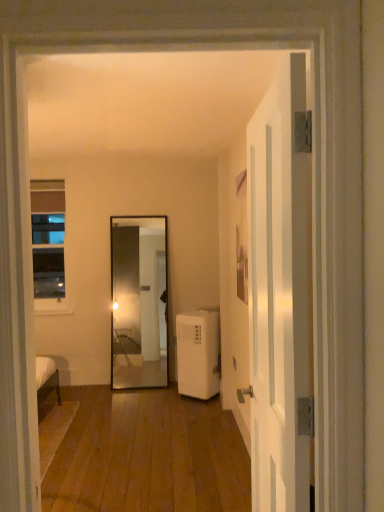
Question: Is white glossy door at right to the left of clear glass window at left from the viewer's perspective?

Choices:
 (A) yes
 (B) no

Answer: (B)

Question: Considering the relative sizes of white glossy door at right and clear glass window at left in the image provided, is white glossy door at right shorter than clear glass window at left?

Choices:
 (A) no
 (B) yes

Answer: (A)

Question: From the image's perspective, would you say white glossy door at right is shown under clear glass window at left?

Choices:
 (A) no
 (B) yes

Answer: (B)

Question: Can you confirm if white glossy door at right is positioned to the right of clear glass window at left?

Choices:
 (A) no
 (B) yes

Answer: (B)

Question: Is white glossy door at right outside clear glass window at left?

Choices:
 (A) no
 (B) yes

Answer: (B)

Question: From a real-world perspective, is clear glass window at left physically located above or below white glossy door at right?

Choices:
 (A) above
 (B) below

Answer: (A)

Question: Considering the positions of clear glass window at left and white glossy door at right in the image, is clear glass window at left wider or thinner than white glossy door at right?

Choices:
 (A) wide
 (B) thin

Answer: (B)

Question: Is clear glass window at left in front of or behind white glossy door at right in the image?

Choices:
 (A) front
 (B) behind

Answer: (B)

Question: Is clear glass window at left spatially inside white glossy door at right, or outside of it?

Choices:
 (A) inside
 (B) outside

Answer: (B)

Question: Is point pyautogui.click(x=256, y=237) closer or farther from the camera than point pyautogui.click(x=190, y=324)?

Choices:
 (A) closer
 (B) farther

Answer: (A)

Question: From the image's perspective, is white glossy door at right located above or below white plastic air conditioner at lower right?

Choices:
 (A) below
 (B) above

Answer: (B)

Question: From a real-world perspective, relative to white plastic air conditioner at lower right, is white glossy door at right vertically above or below?

Choices:
 (A) above
 (B) below

Answer: (A)

Question: Is white glossy door at right in front of or behind white plastic air conditioner at lower right in the image?

Choices:
 (A) behind
 (B) front

Answer: (B)

Question: In terms of height, does white glossy door at right look taller or shorter compared to clear glass window at left?

Choices:
 (A) tall
 (B) short

Answer: (A)

Question: Considering the relative positions of white glossy door at right and clear glass window at left in the image provided, is white glossy door at right to the left or to the right of clear glass window at left?

Choices:
 (A) left
 (B) right

Answer: (B)